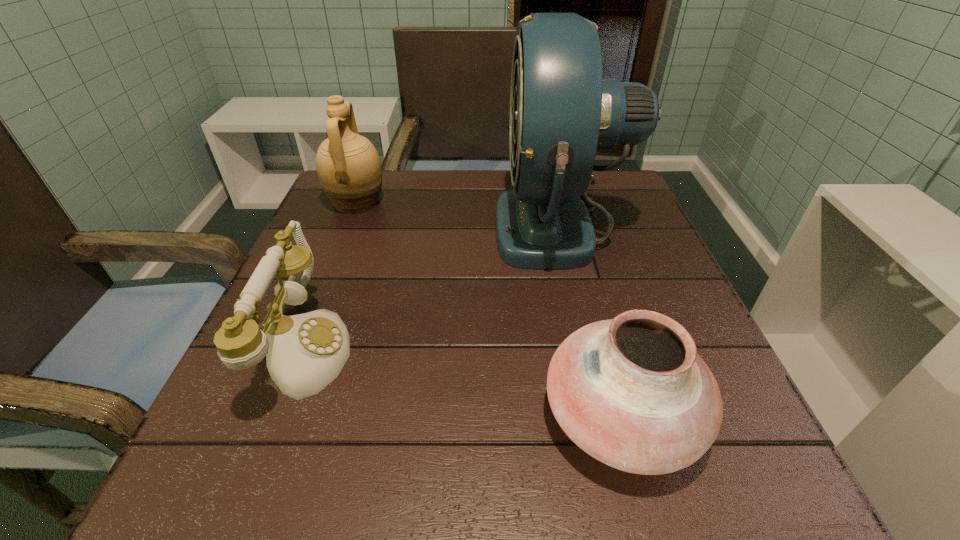
Where is `vacant area that lies between the telephone and the second tallest object`? The image size is (960, 540). vacant area that lies between the telephone and the second tallest object is located at coordinates (331, 275).

Locate an element on the screen. This screenshot has width=960, height=540. empty space that is in between the fan and the telephone is located at coordinates tap(433, 287).

Identify the location of vacant space in between the pottery and the pitcher. (489, 309).

Locate an element on the screen. The width and height of the screenshot is (960, 540). free spot between the pitcher and the fan is located at coordinates (459, 214).

Find the location of `free space between the third shortest object and the pottery`. free space between the third shortest object and the pottery is located at coordinates (489, 309).

Select which object appears as the closest to the pitcher. Please provide its 2D coordinates. Your answer should be formatted as a tuple, i.e. [(x, y)], where the tuple contains the x and y coordinates of a point satisfying the conditions above.

[(304, 353)]

The image size is (960, 540). In order to click on object that is the second nearest to the pottery in this screenshot , I will do `click(304, 353)`.

Find the location of a particular element. free space that satisfies the following two spatial constraints: 1. in front of the tallest object to blow air; 2. on the right side of the pottery is located at coordinates (608, 417).

The height and width of the screenshot is (540, 960). What are the coordinates of `blank space that satisfies the following two spatial constraints: 1. on the back side of the pottery; 2. in front of the fan to blow air` in the screenshot? It's located at pyautogui.click(x=569, y=225).

Locate an element on the screen. The height and width of the screenshot is (540, 960). vacant space that satisfies the following two spatial constraints: 1. in front of the tallest object to blow air; 2. on the right side of the pottery is located at coordinates (608, 417).